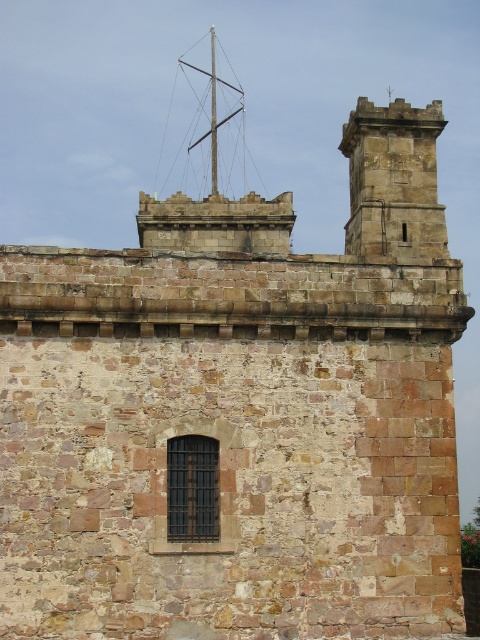
Is point (350, 132) farther from viewer compared to point (241, 106)?

No, it is in front of (241, 106).

Which is above, stone tower at upper right or metallic silver mast at upper center?

metallic silver mast at upper center

At what (x,y) coordinates should I click in order to perform the action: click on stone tower at upper right. Please return your answer as a coordinate pair (x, y). Looking at the image, I should click on (394, 180).